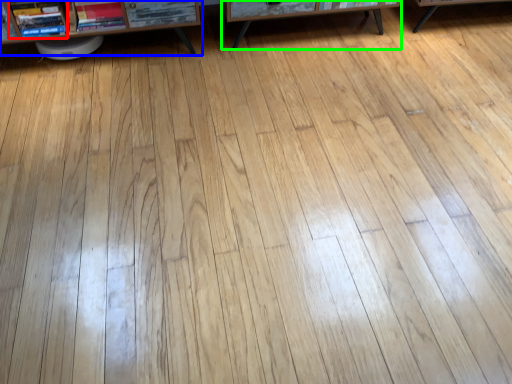
Question: Based on their relative distances, which object is farther from book (highlighted by a red box)? Choose from shelf (highlighted by a blue box) and table (highlighted by a green box).

Choices:
 (A) shelf
 (B) table

Answer: (B)